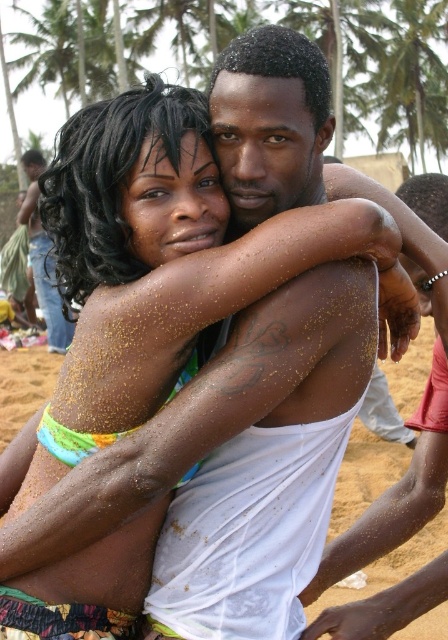
Question: Does smooth white shirt at center appear over sandy skin at center?

Choices:
 (A) no
 (B) yes

Answer: (A)

Question: Which point is closer to the camera?

Choices:
 (A) sandy skin at center
 (B) smooth white shirt at center
 (C) green leafy palm tree at upper center

Answer: (B)

Question: Which of the following is the farthest from the observer?

Choices:
 (A) (41, 289)
 (B) (396, 72)

Answer: (B)

Question: Can you confirm if smooth white shirt at center is smaller than sandy skin at center?

Choices:
 (A) yes
 (B) no

Answer: (A)

Question: Does smooth white shirt at center appear on the left side of sandy skin at center?

Choices:
 (A) yes
 (B) no

Answer: (B)

Question: Among these points, which one is nearest to the camera?

Choices:
 (A) (44, 246)
 (B) (352, 628)

Answer: (B)